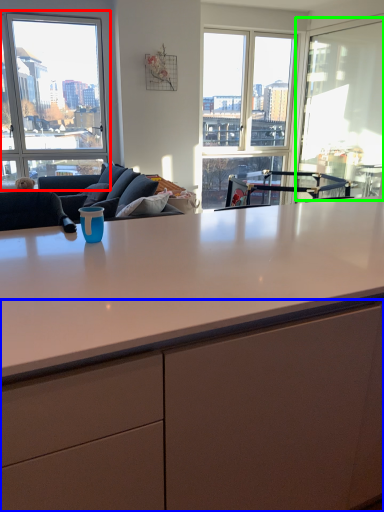
Question: Which object is positioned closest to window (highlighted by a red box)? Select from cabinetry (highlighted by a blue box) and window screen (highlighted by a green box).

Choices:
 (A) cabinetry
 (B) window screen

Answer: (B)